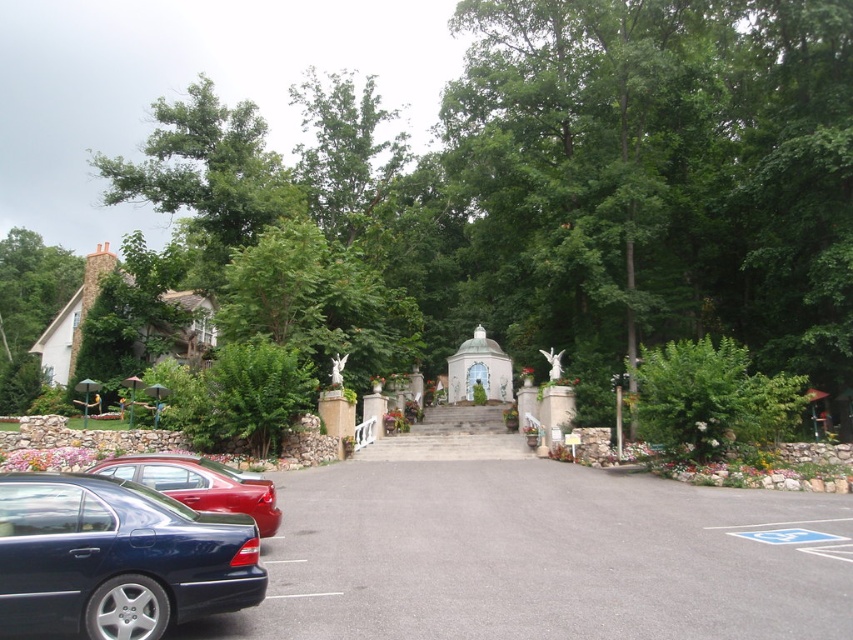
In the scene shown: You are standing at the entrance of the estate and want to reach the gazebo pavilion. There are two points marked on the map as point 1 at coordinates (581, 234) and point 2 at coordinates (216, 492). Which point should you head towards first to reach the gazebo pavilion?

You should head towards point 2 at coordinates (216, 492) first because point 1 at coordinates (581, 234) is behind it, so point 2 is closer to your starting position at the entrance.

You are a visitor arriving at the estate and need to park your car. You see the shiny red sedan at center and the white stone steps at center. Which object is closer to the entrance of the estate?

The white stone steps at center are closer to the entrance of the estate because the shiny red sedan at center is to the left of them, implying the steps are positioned further along the path towards the entrance.